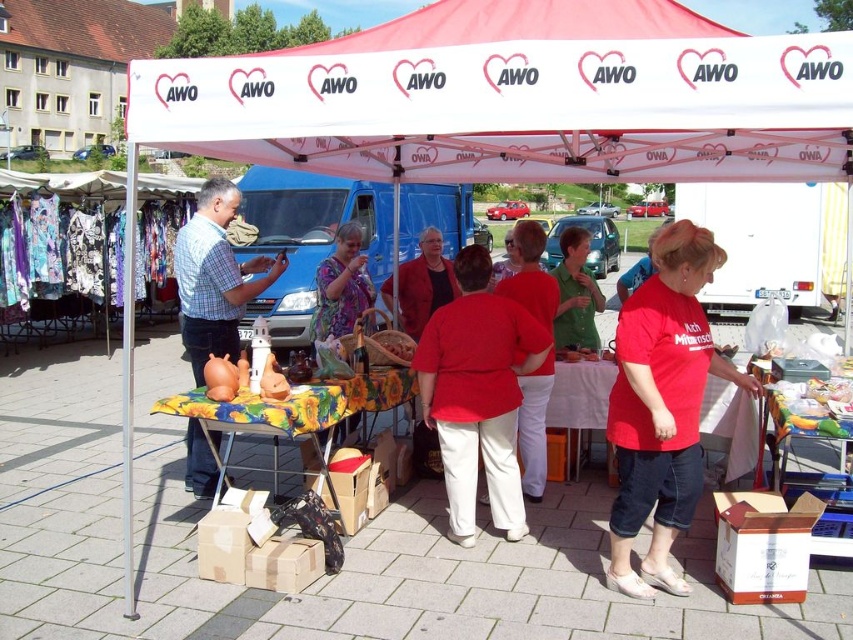
You are standing at the entrance of the market and see a point marked at coordinates [576,294]. What color is the shirt of the person located at that point?

The point at coordinates [576,294] marks the green matte shirt at center, so the person there is wearing a green matte shirt.

In the scene shown: You are a photographer at the market and need to capture a photo of the matte red shirt at center and the matte red coat at center. Which one will appear larger in the photo?

The matte red shirt at center will appear smaller than the matte red coat at center in the photo because it is physically smaller.